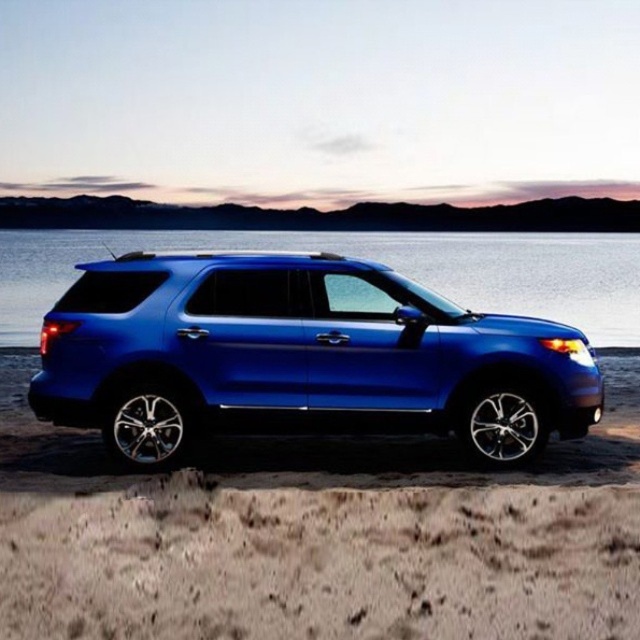
Is point (557, 497) positioned behind point (435, 259)?

No.

Is point (582, 547) in front of point (602, 326)?

Yes.

Which is in front, point (630, 538) or point (436, 262)?

Point (630, 538)

Find the location of a particular element. sandy beige at lower center is located at coordinates (321, 563).

Which is more to the right, metallic blue suv at center or blue metallic water at center?

Positioned to the right is blue metallic water at center.

Between point (323, 348) and point (598, 262), which one is positioned behind?

The point (598, 262) is more distant.

The width and height of the screenshot is (640, 640). What do you see at coordinates (300, 358) in the screenshot?
I see `metallic blue suv at center` at bounding box center [300, 358].

At what (x,y) coordinates should I click in order to perform the action: click on metallic blue suv at center. Please return your answer as a coordinate pair (x, y). Looking at the image, I should click on (300, 358).

Does sandy beige at lower center have a greater height compared to metallic blue suv at center?

Incorrect, sandy beige at lower center's height is not larger of metallic blue suv at center's.

The image size is (640, 640). Identify the location of sandy beige at lower center. (321, 563).

Where is `sandy beige at lower center`? The height and width of the screenshot is (640, 640). sandy beige at lower center is located at coordinates (321, 563).